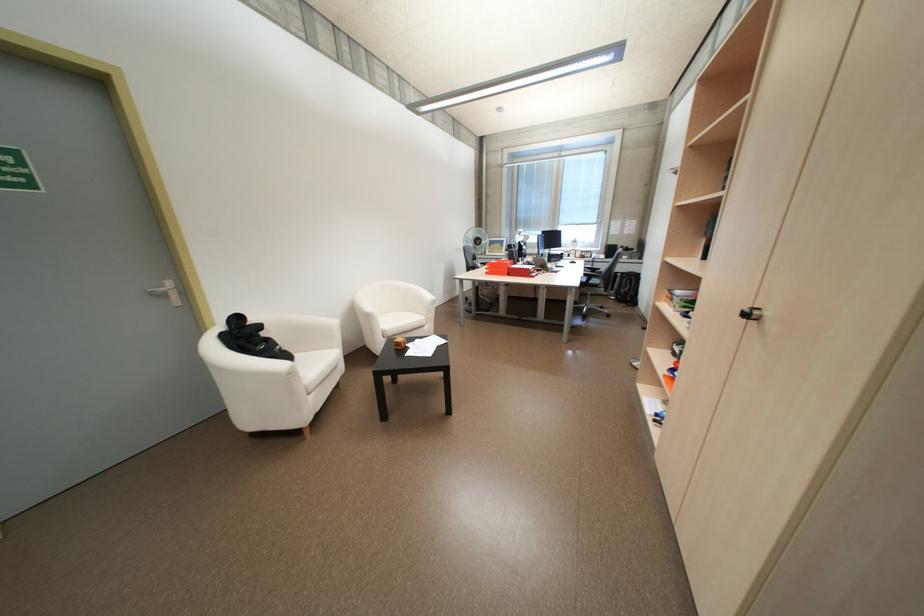
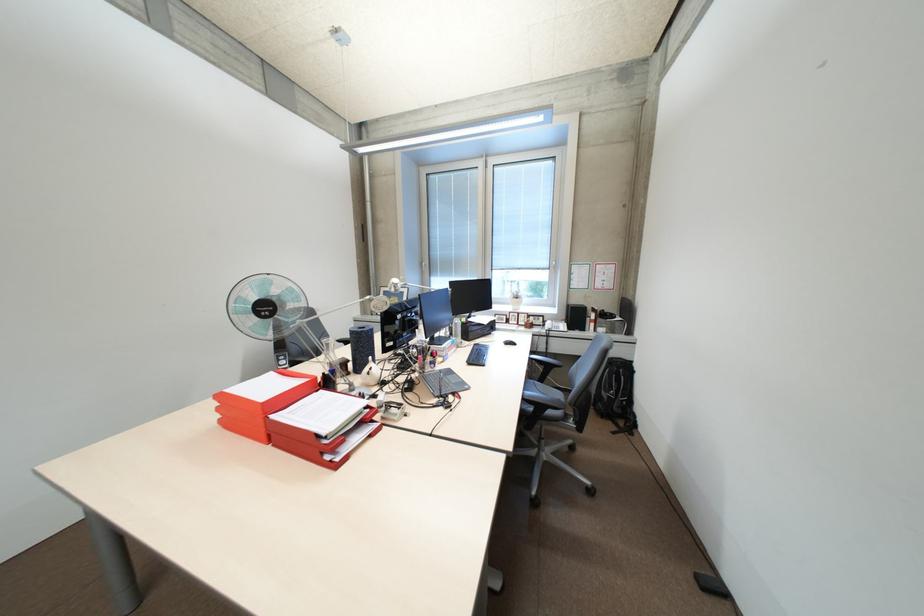
In the second image, find the point that corresponds to (x=574, y=262) in the first image.

(504, 341)